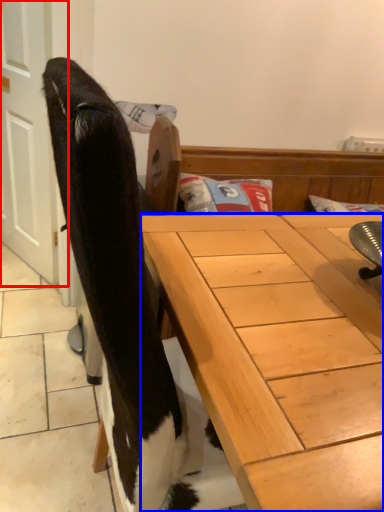
Question: Which of the following is the closest to the observer, screen door (highlighted by a red box) or desk (highlighted by a blue box)?

Choices:
 (A) screen door
 (B) desk

Answer: (B)